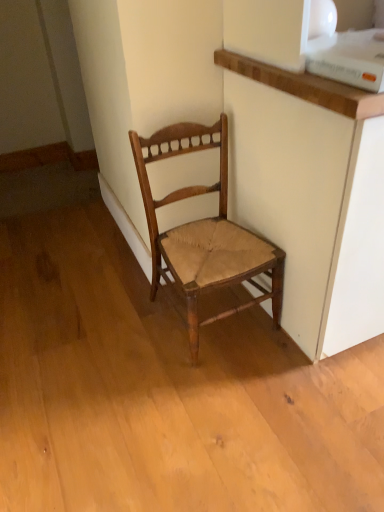
Locate an element on the screen. The image size is (384, 512). free space to the left of wooden woven seat chair at center is located at coordinates (136, 350).